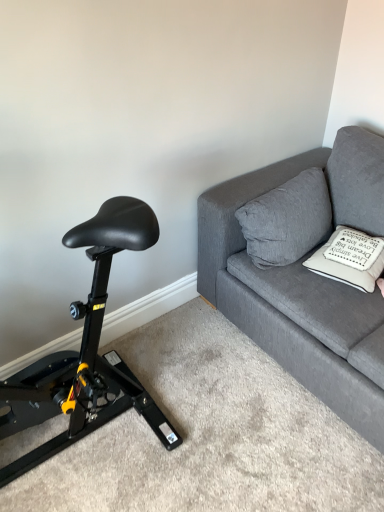
Question: Is white soft cushion at upper right, which is counted as the second pillow, starting from the left, at the back of gray fabric pillow at upper right, which is the first pillow from left to right?

Choices:
 (A) yes
 (B) no

Answer: (B)

Question: Can white soft cushion at upper right, which is counted as the second pillow, starting from the left, be found inside gray fabric pillow at upper right, the second pillow positioned from the right?

Choices:
 (A) no
 (B) yes

Answer: (A)

Question: Can you confirm if gray fabric pillow at upper right, the second pillow positioned from the right, is bigger than white soft cushion at upper right, which is counted as the second pillow, starting from the left?

Choices:
 (A) yes
 (B) no

Answer: (A)

Question: Considering the relative sizes of gray fabric pillow at upper right, which is the first pillow from left to right, and white soft cushion at upper right, which is counted as the second pillow, starting from the left, in the image provided, is gray fabric pillow at upper right, which is the first pillow from left to right, shorter than white soft cushion at upper right, which is counted as the second pillow, starting from the left,?

Choices:
 (A) yes
 (B) no

Answer: (B)

Question: Could you tell me if gray fabric pillow at upper right, which is the first pillow from left to right, is turned towards white soft cushion at upper right, which is counted as the second pillow, starting from the left?

Choices:
 (A) yes
 (B) no

Answer: (A)

Question: Is white soft cushion at upper right, marked as the first pillow in a right-to-left arrangement, taller or shorter than textured gray couch at upper right?

Choices:
 (A) short
 (B) tall

Answer: (A)

Question: Visually, is white soft cushion at upper right, marked as the first pillow in a right-to-left arrangement, positioned to the left or to the right of textured gray couch at upper right?

Choices:
 (A) right
 (B) left

Answer: (B)

Question: From a real-world perspective, is white soft cushion at upper right, marked as the first pillow in a right-to-left arrangement, above or below textured gray couch at upper right?

Choices:
 (A) below
 (B) above

Answer: (B)

Question: Is white soft cushion at upper right, which is counted as the second pillow, starting from the left, wider or thinner than textured gray couch at upper right?

Choices:
 (A) wide
 (B) thin

Answer: (B)

Question: From a real-world perspective, relative to white soft cushion at upper right, marked as the first pillow in a right-to-left arrangement, is black leather saddle at left vertically above or below?

Choices:
 (A) below
 (B) above

Answer: (B)

Question: Is black leather saddle at left bigger or smaller than white soft cushion at upper right, marked as the first pillow in a right-to-left arrangement?

Choices:
 (A) small
 (B) big

Answer: (B)

Question: Is black leather saddle at left in front of or behind white soft cushion at upper right, marked as the first pillow in a right-to-left arrangement, in the image?

Choices:
 (A) front
 (B) behind

Answer: (A)

Question: Based on their positions, is black leather saddle at left located to the left or right of white soft cushion at upper right, which is counted as the second pillow, starting from the left?

Choices:
 (A) right
 (B) left

Answer: (B)

Question: Is black leather saddle at left to the left or to the right of textured gray couch at upper right in the image?

Choices:
 (A) left
 (B) right

Answer: (A)

Question: In terms of height, does black leather saddle at left look taller or shorter compared to textured gray couch at upper right?

Choices:
 (A) tall
 (B) short

Answer: (A)